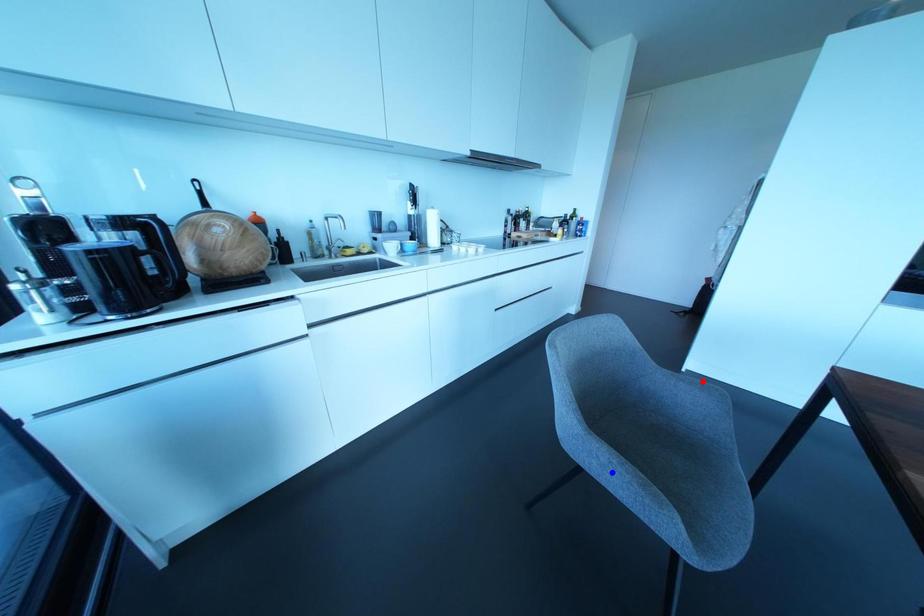
Question: Two points are marked on the image. Which point is closer to the camera?

Choices:
 (A) Blue point is closer.
 (B) Red point is closer.

Answer: (A)